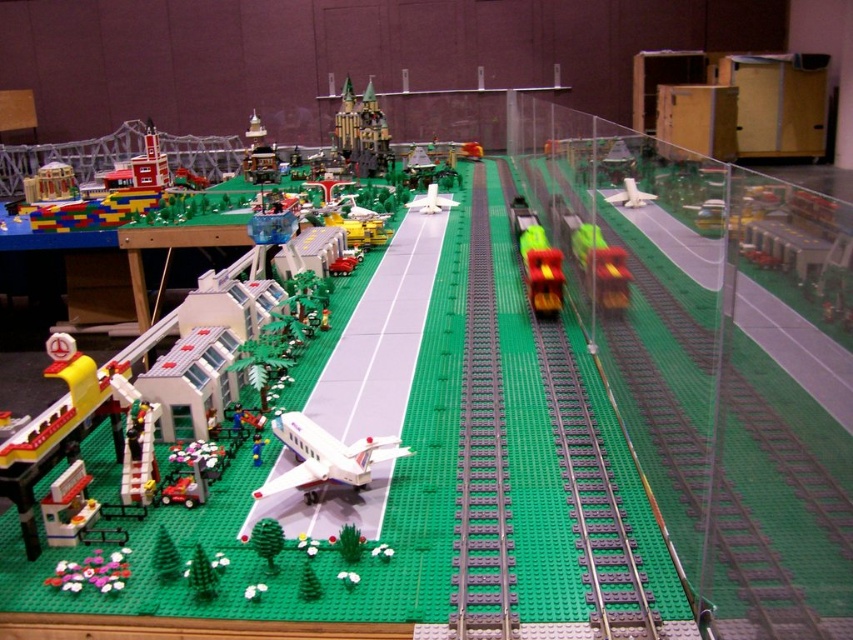
Question: Is brick castle at center smaller than shiny yellow train at center?

Choices:
 (A) no
 (B) yes

Answer: (A)

Question: Observing the image, what is the correct spatial positioning of shiny yellow train at center in reference to white matte airplane at upper right?

Choices:
 (A) below
 (B) above

Answer: (B)

Question: Which object appears farthest from the camera in this image?

Choices:
 (A) translucent green plastic truck at center-right
 (B) shiny yellow train at center
 (C) white matte airplane at center

Answer: (C)

Question: Which object is farther from the camera taking this photo?

Choices:
 (A) green plastic train track at center
 (B) translucent green plastic truck at center-right

Answer: (B)

Question: Does brick castle at center have a smaller size compared to white matte airplane at center?

Choices:
 (A) no
 (B) yes

Answer: (A)

Question: Which point is closer to the camera?

Choices:
 (A) (425, 205)
 (B) (473, 355)

Answer: (B)